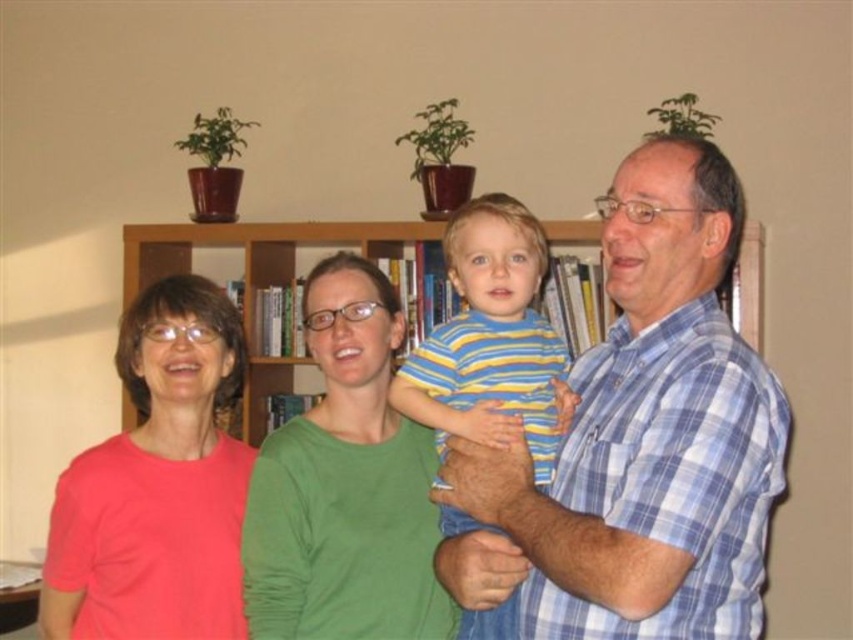
Question: Can you confirm if striped cotton shirt at center is positioned below wooden bookshelf at center?

Choices:
 (A) yes
 (B) no

Answer: (A)

Question: Which of the following is the closest to the observer?

Choices:
 (A) wooden bookshelf at center
 (B) blue plaid shirt at right
 (C) matte pink shirt at left
 (D) green matte shirt at center

Answer: (B)

Question: Is matte pink shirt at left positioned before striped cotton shirt at center?

Choices:
 (A) yes
 (B) no

Answer: (B)

Question: Which point is farther to the camera?

Choices:
 (A) blue plaid shirt at right
 (B) wooden bookshelf at center
 (C) matte pink shirt at left

Answer: (B)

Question: Which object is positioned farthest from the green matte shirt at center?

Choices:
 (A) matte pink shirt at left
 (B) wooden bookshelf at center
 (C) striped cotton shirt at center
 (D) blue plaid shirt at right

Answer: (B)

Question: Can you confirm if matte pink shirt at left is smaller than green matte shirt at center?

Choices:
 (A) no
 (B) yes

Answer: (A)